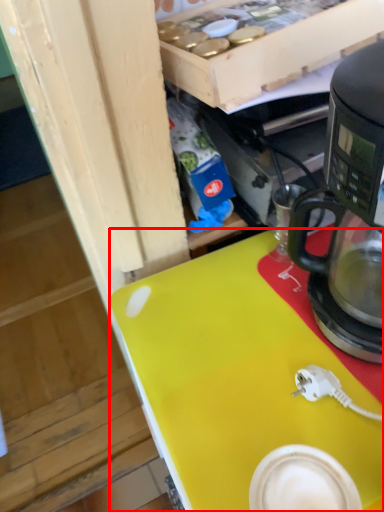
Question: Observing the image, what is the correct spatial positioning of desk (annotated by the red box) in reference to coffee maker?

Choices:
 (A) left
 (B) right

Answer: (A)